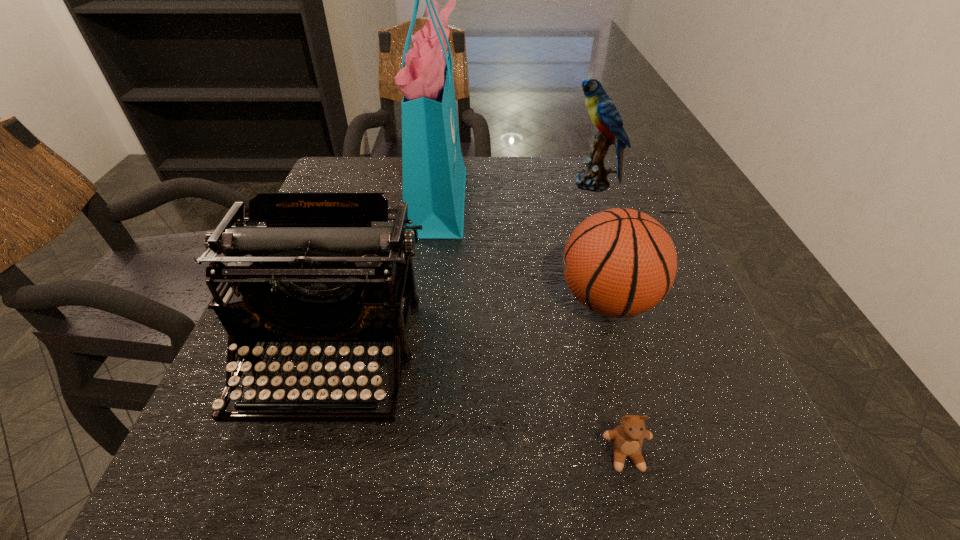
I want to click on free space in the image that satisfies the following two spatial constraints: 1. on the side where the inflation valve is located; 2. on the front-facing side of the shortest object, so click(653, 455).